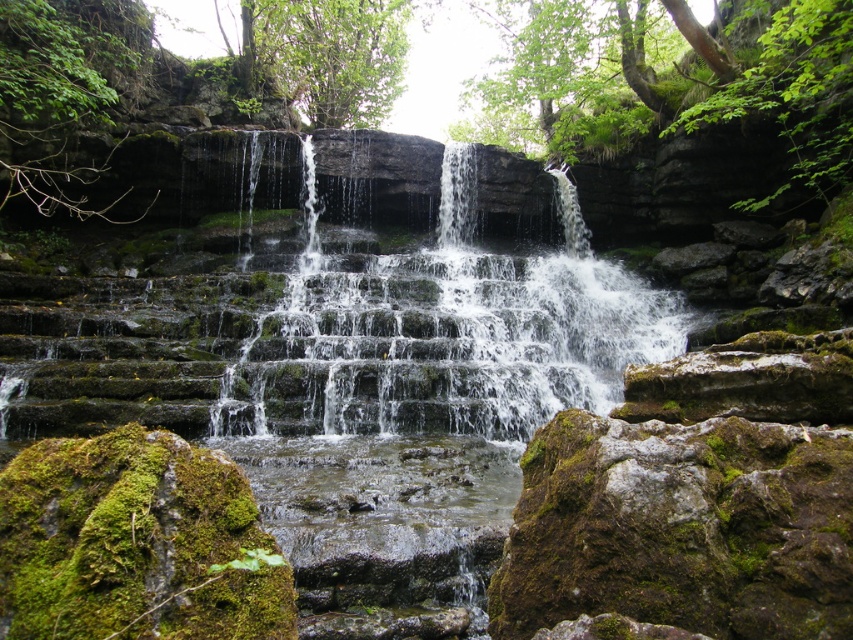
You are a hiker trying to cross the waterfall area. You see the green mossy rock at center and the clear water at center. Which path would be safer to step on?

The green mossy rock at center is wider than clear water at center, so stepping on the green mossy rock at center would be safer as it provides a more stable surface.

You are a hiker who wants to cross the waterfall area safely. You see the green mossy rock at center and the clear water at center. Which object should you step on to avoid getting wet?

You should step on the green mossy rock at center because it is in front of the clear water at center, meaning it is above the water and provides a dry path.